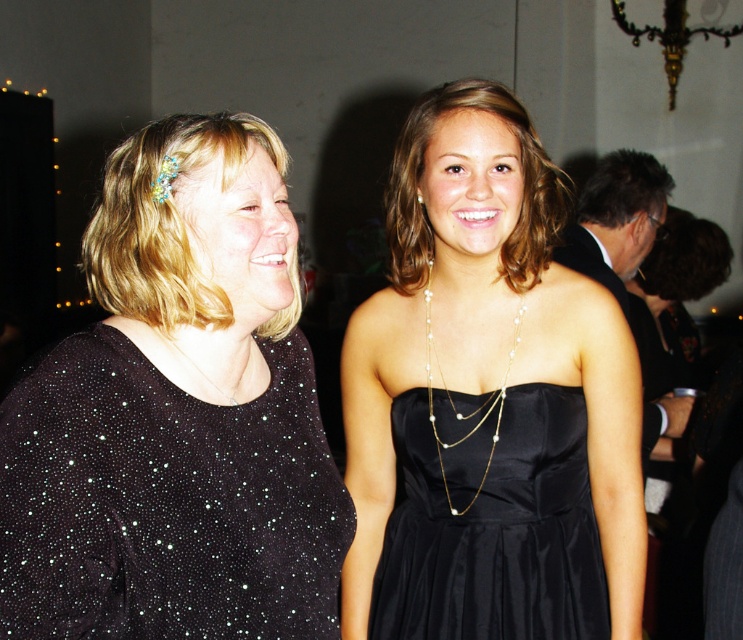
Question: Is pearl gold chain at center in front of silver metallic necklace at center?

Choices:
 (A) no
 (B) yes

Answer: (A)

Question: Which of the following is the farthest from the observer?

Choices:
 (A) (447, 492)
 (B) (215, 216)
 (C) (559, 417)
 (D) (452, 227)

Answer: (A)

Question: Which object is farther from the camera taking this photo?

Choices:
 (A) satin black dress at center
 (B) black satin dress at center
 (C) pearl gold chain at center
 (D) silver metallic necklace at center

Answer: (C)

Question: Which object is the farthest from the sparkly black dress at center?

Choices:
 (A) pearl gold chain at center
 (B) silver metallic necklace at center

Answer: (A)

Question: Does pearl gold chain at center come in front of silver metallic necklace at center?

Choices:
 (A) yes
 (B) no

Answer: (B)

Question: Is sparkly black dress at center in front of pearl gold chain at center?

Choices:
 (A) yes
 (B) no

Answer: (A)